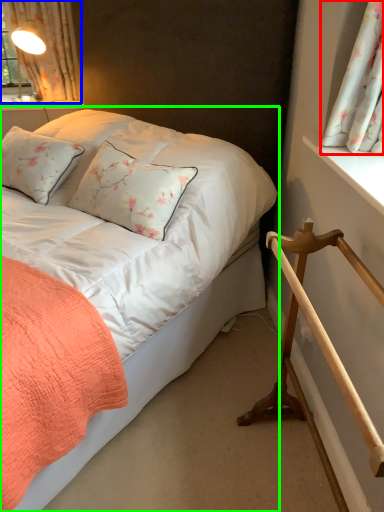
Question: Which object is positioned farthest from curtain (highlighted by a red box)? Select from curtain (highlighted by a blue box) and bed (highlighted by a green box).

Choices:
 (A) curtain
 (B) bed

Answer: (A)